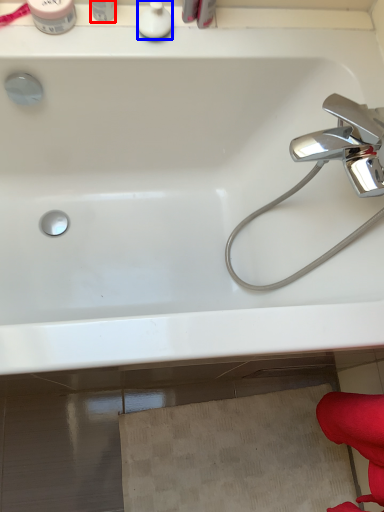
Question: Among these objects, which one is nearest to the camera, toiletry (highlighted by a red box) or toiletry (highlighted by a blue box)?

Choices:
 (A) toiletry
 (B) toiletry

Answer: (A)